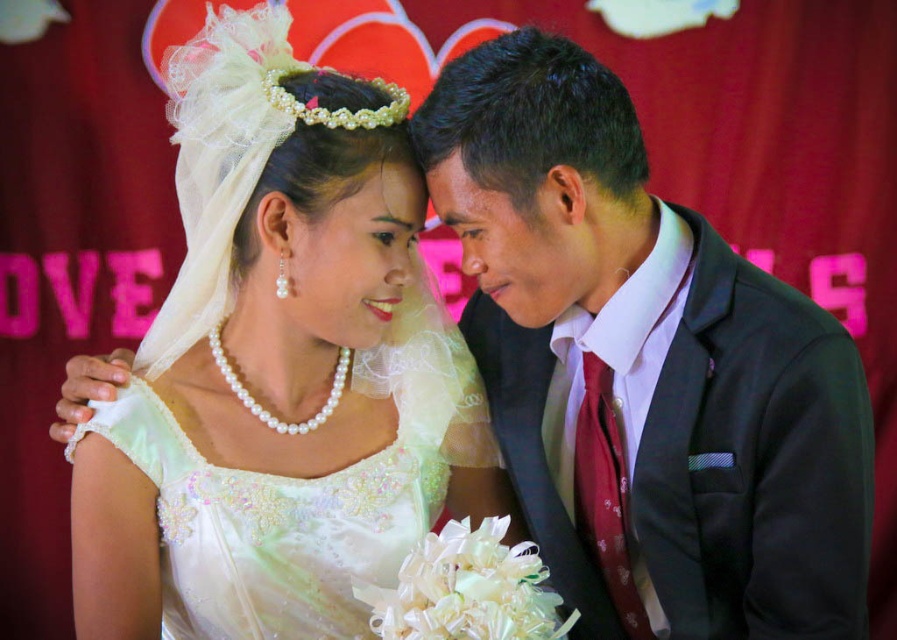
Based on the scene description, which object is smaller in size between the white satin dress at center and the satin black suit at right?

The white satin dress at center is smaller in size compared to the satin black suit at right according to the description.

You are a photographer positioned in front of the couple. You need to adjust the lighting so that the white satin dress at center and the satin black suit at right are both well illuminated. Which object should you focus the light on first to ensure proper exposure?

The white satin dress at center is further to the viewer than the satin black suit at right, so you should focus the light on the white satin dress at center first to ensure it is properly exposed before adjusting for the satin black suit at right.